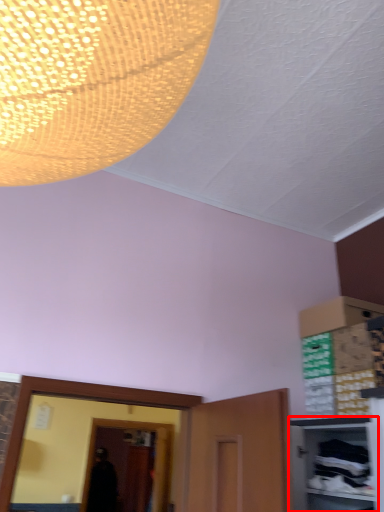
Question: In this image, where is cabinetry (annotated by the red box) located relative to glass door?

Choices:
 (A) left
 (B) right

Answer: (B)